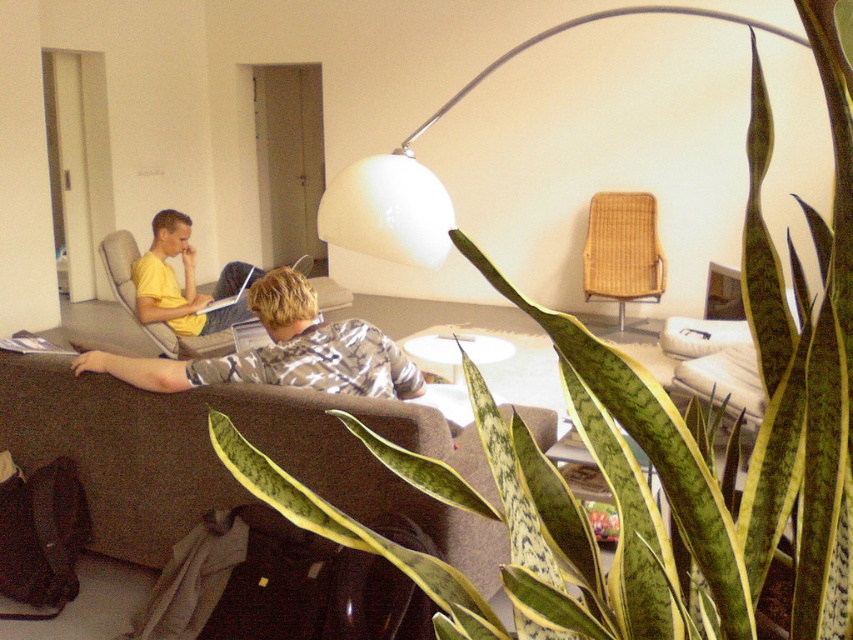
You are a guest entering the living room and want to sit down. The brown fabric couch at lower center and the matte gray armchair at left are available. Which seating option has a higher backrest?

The matte gray armchair at left has a higher backrest than the brown fabric couch at lower center because the brown fabric couch at lower center is shorter than the matte gray armchair at left.

You are a photographer setting up a shoot in this room. You want to position a camera so it can capture both the white glossy arc lamp at upper center and the silver metallic laptop at center clearly. Based on their positions, which object should you focus on first to ensure both are in frame?

The white glossy arc lamp at upper center is in front of the silver metallic laptop at center, so you should focus on the white glossy arc lamp at upper center first to ensure both are in frame.

You are a photographer setting up a shoot in this room. You need to position a camera on a tripod between the white glossy arc lamp at upper center and the silver metallic laptop at center. Since the lamp is wider than the laptop, will the camera fit between them if the camera requires 1.2 meters of space?

The white glossy arc lamp at upper center is wider than the silver metallic laptop at center. The camera requires 1.2 meters of space, but the description only provides information about their widths, not the distance between them. Therefore, it is unclear if there is enough space for the camera between them based on the given details.